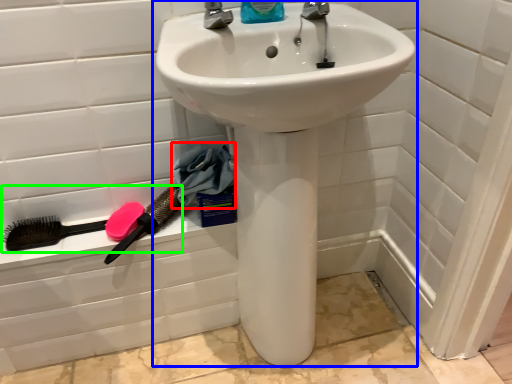
Question: Considering the real-world distances, which object is farthest from material (highlighted by a red box)? sink (highlighted by a blue box) or brush (highlighted by a green box)?

Choices:
 (A) sink
 (B) brush

Answer: (A)